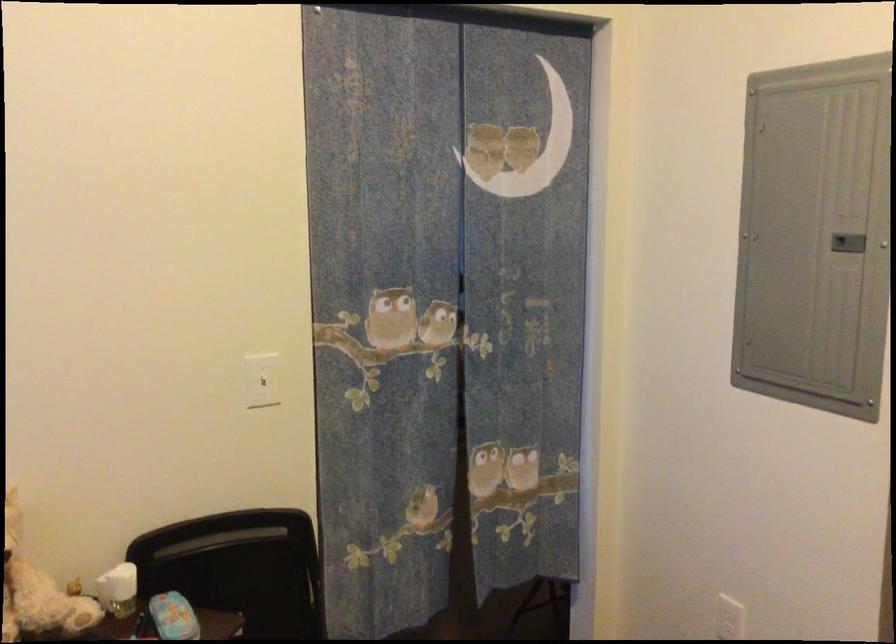
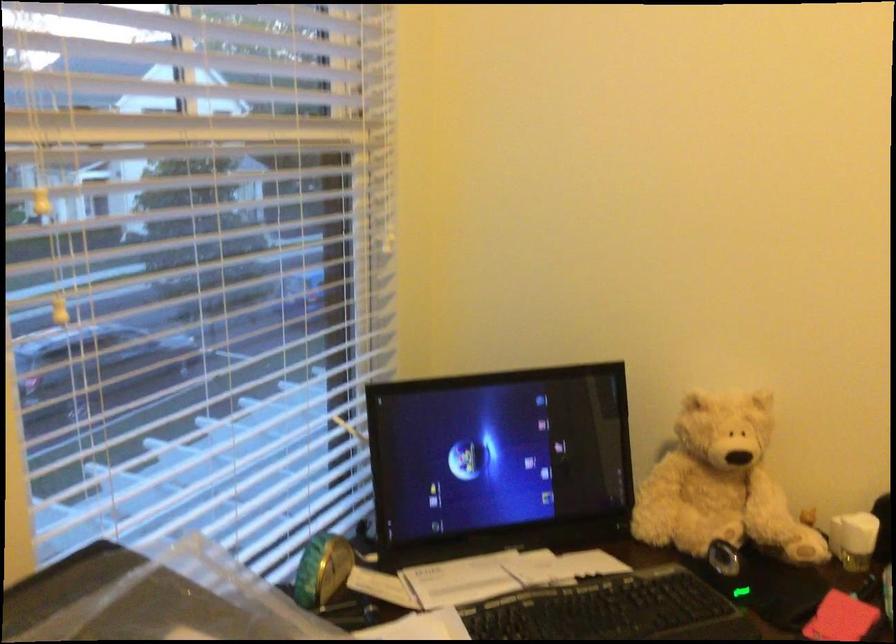
Question: Based on the continuous images, in which direction is the camera rotating? Reply with the corresponding letter.

Choices:
 (A) Left
 (B) Right
 (C) Up
 (D) Down

Answer: (A)